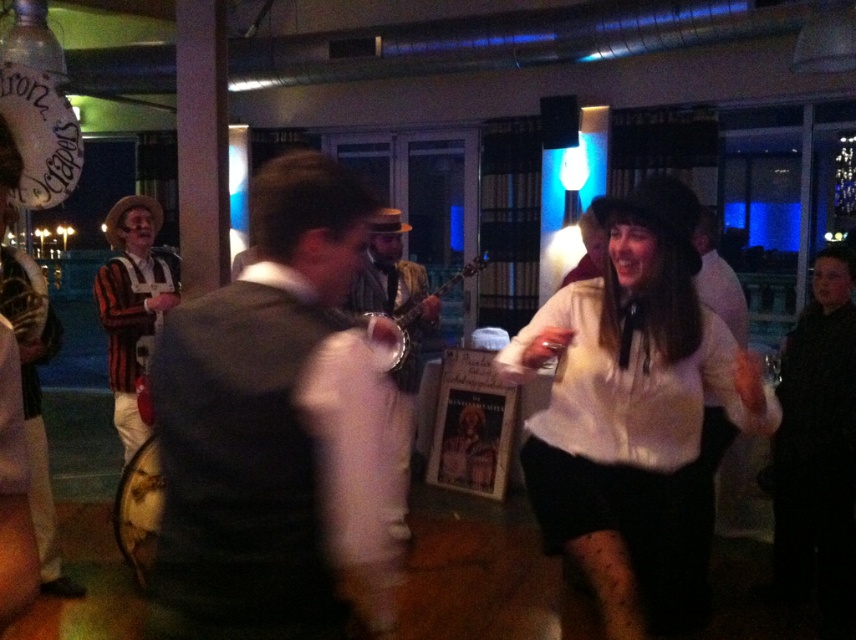
Does dark gray suit at center have a greater width compared to shiny brown leather jacket at center?

Indeed, dark gray suit at center has a greater width compared to shiny brown leather jacket at center.

Is dark gray suit at center closer to camera compared to shiny brown leather jacket at center?

That is True.

Does point (270, 493) lie in front of point (417, 358)?

Yes, it is in front of point (417, 358).

This screenshot has height=640, width=856. In order to click on dark gray suit at center in this screenshot , I will do `click(275, 432)`.

Does white matte shirt at center have a smaller size compared to white matte dress at center?

No.

Measure the distance between white matte shirt at center and camera.

They are 1.65 meters apart.

This screenshot has height=640, width=856. What do you see at coordinates (629, 403) in the screenshot? I see `white matte shirt at center` at bounding box center [629, 403].

Identify the location of white matte shirt at center. This screenshot has width=856, height=640. (629, 403).

Does point (402, 493) come behind point (407, 340)?

Yes, it is.

Who is more distant from viewer, (370,228) or (402,344)?

Point (402,344)

In order to click on shiny brown leather jacket at center in this screenshot , I will do `click(408, 330)`.